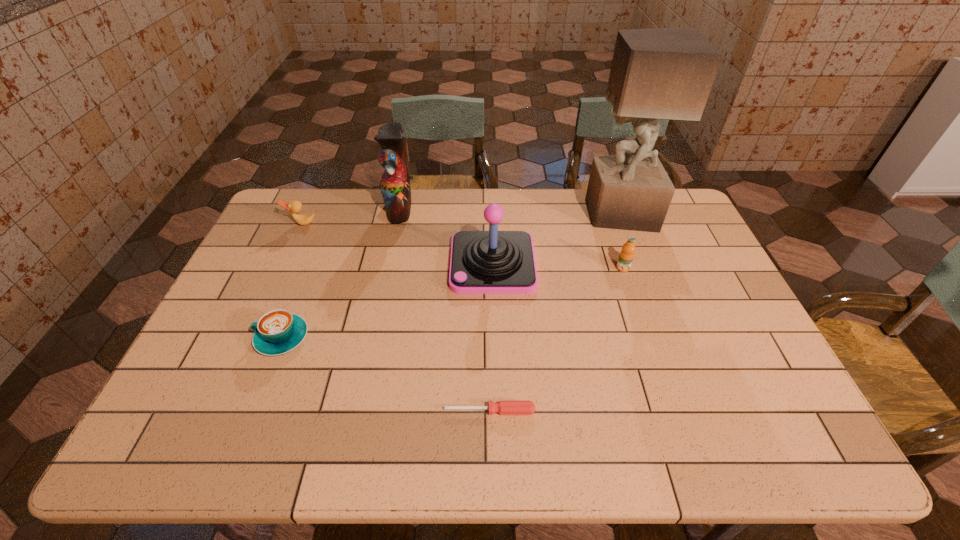
At what (x,y) coordinates should I click in order to perform the action: click on sculpture. Please return your answer as a coordinate pair (x, y). Looking at the image, I should click on (662, 73).

Locate an element on the screen. This screenshot has width=960, height=540. the third object from left to right is located at coordinates (395, 184).

Identify the location of parrot. (395, 184).

Where is `joystick`? This screenshot has height=540, width=960. joystick is located at coordinates (482, 262).

Find the location of a particular element. orange juice is located at coordinates (626, 255).

What are the coordinates of `the third shortest object` in the screenshot? It's located at pyautogui.click(x=295, y=206).

Locate an element on the screen. the sixth tallest object is located at coordinates (277, 332).

Where is `the sixth farthest object`? the sixth farthest object is located at coordinates (277, 332).

This screenshot has width=960, height=540. I want to click on the shortest object, so click(502, 407).

I want to click on the nearest object, so click(502, 407).